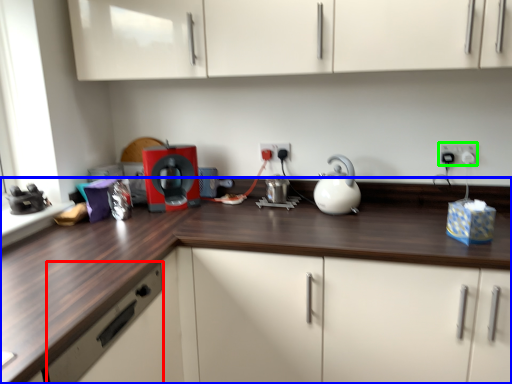
Question: Which object is positioned farthest from drawer (highlighted by a red box)? Select from countertop (highlighted by a blue box) and electric outlet (highlighted by a green box).

Choices:
 (A) countertop
 (B) electric outlet

Answer: (B)